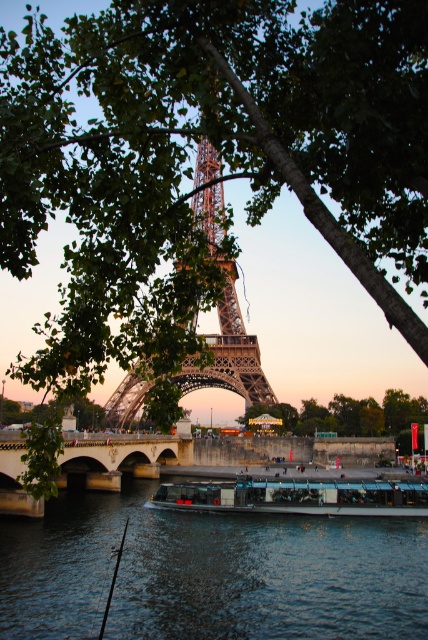
Between point (113, 611) and point (255, 410), which one is positioned behind?

The point (255, 410) is more distant.

Where is `dark blue water at center`? This screenshot has height=640, width=428. dark blue water at center is located at coordinates (208, 573).

Can you confirm if metallic glass boat at center is bigger than green leafy tree at center?

No.

Can you confirm if metallic glass boat at center is thinner than green leafy tree at center?

In fact, metallic glass boat at center might be wider than green leafy tree at center.

Between point (362, 506) and point (357, 401), which one is positioned in front?

Positioned in front is point (362, 506).

The height and width of the screenshot is (640, 428). Find the location of `metallic glass boat at center`. metallic glass boat at center is located at coordinates (294, 496).

Based on the photo, is metallic brown eiffel tower at center to the left of stone bridge at center from the viewer's perspective?

No, metallic brown eiffel tower at center is not to the left of stone bridge at center.

Between point (231, 284) and point (155, 476), which one is positioned behind?

Positioned behind is point (231, 284).

Find the location of a particular element. metallic brown eiffel tower at center is located at coordinates (222, 300).